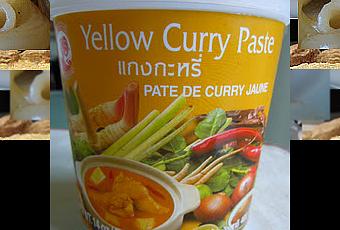
Image resolution: width=340 pixels, height=230 pixels. I want to click on food container, so click(164, 130).